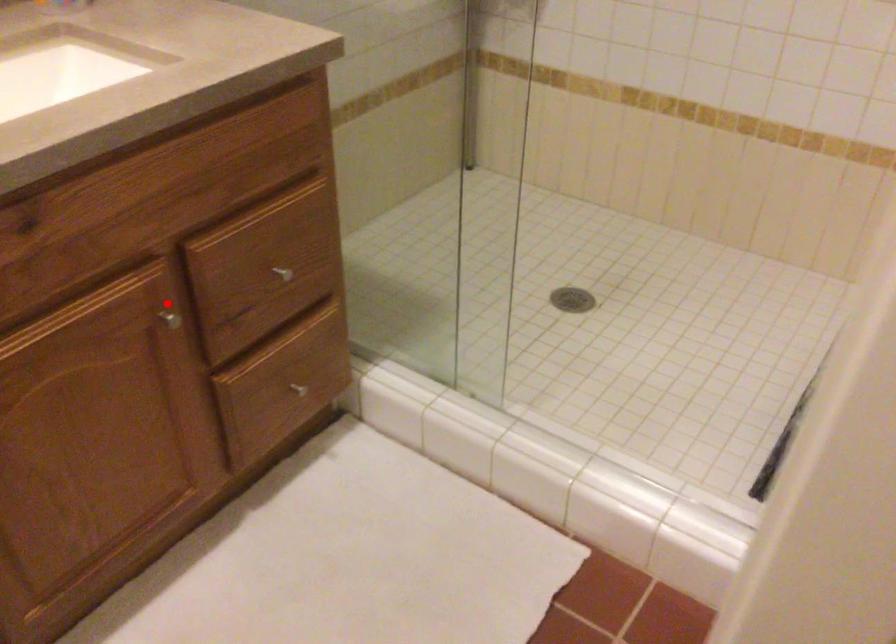
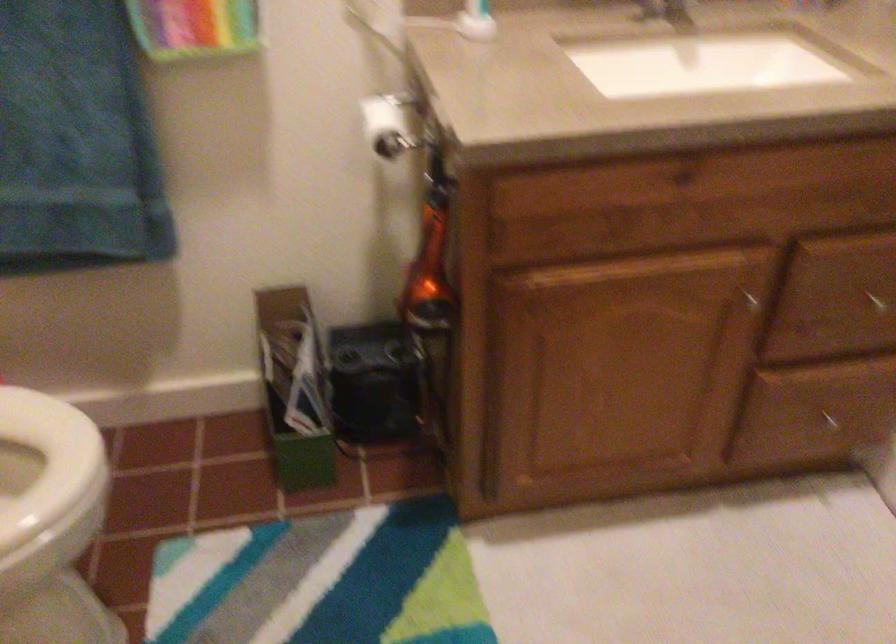
The point at the highlighted location is marked in the first image. Where is the corresponding point in the second image?

(752, 285)